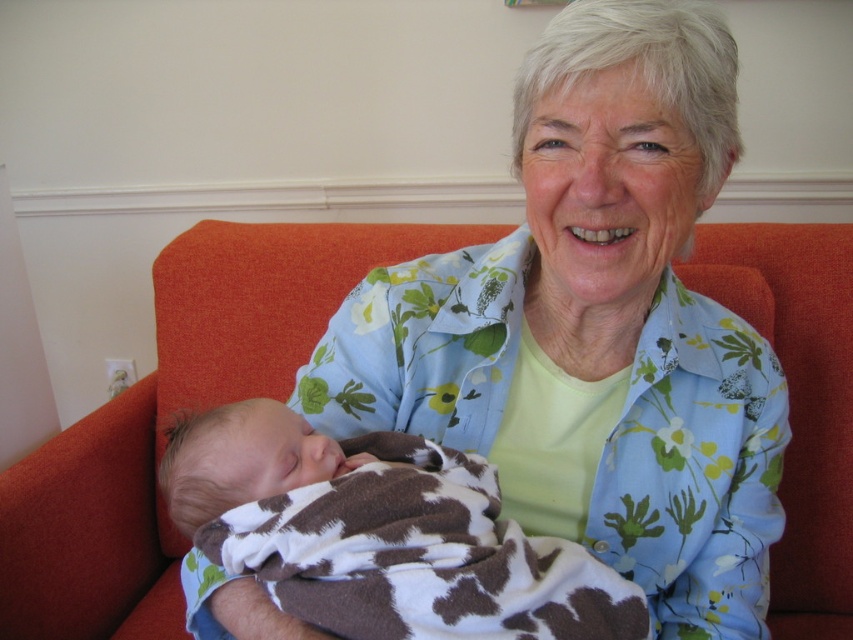
Between point (238, 260) and point (431, 464), which one is positioned in front?

Positioned in front is point (431, 464).

Is point (283, 358) farther from viewer compared to point (554, 588)?

That is True.

Who is more forward, [780,275] or [402,465]?

Point [402,465] is in front.

Identify the location of orange fabric couch at center. Image resolution: width=853 pixels, height=640 pixels. (171, 416).

Does floral shirt at center appear on the left side of orange fabric couch at center?

No, floral shirt at center is not to the left of orange fabric couch at center.

Is floral shirt at center taller than orange fabric couch at center?

Incorrect, floral shirt at center's height is not larger of orange fabric couch at center's.

Is point (750, 436) closer to viewer compared to point (740, 300)?

Yes, it is.

Where is `floral shirt at center`? The image size is (853, 640). floral shirt at center is located at coordinates click(595, 326).

Is floral shirt at center thinner than cowprint fabric newborn at lower left?

In fact, floral shirt at center might be wider than cowprint fabric newborn at lower left.

Consider the image. Which of these two, floral shirt at center or cowprint fabric newborn at lower left, stands taller?

With more height is floral shirt at center.

Locate an element on the screen. Image resolution: width=853 pixels, height=640 pixels. floral shirt at center is located at coordinates (595, 326).